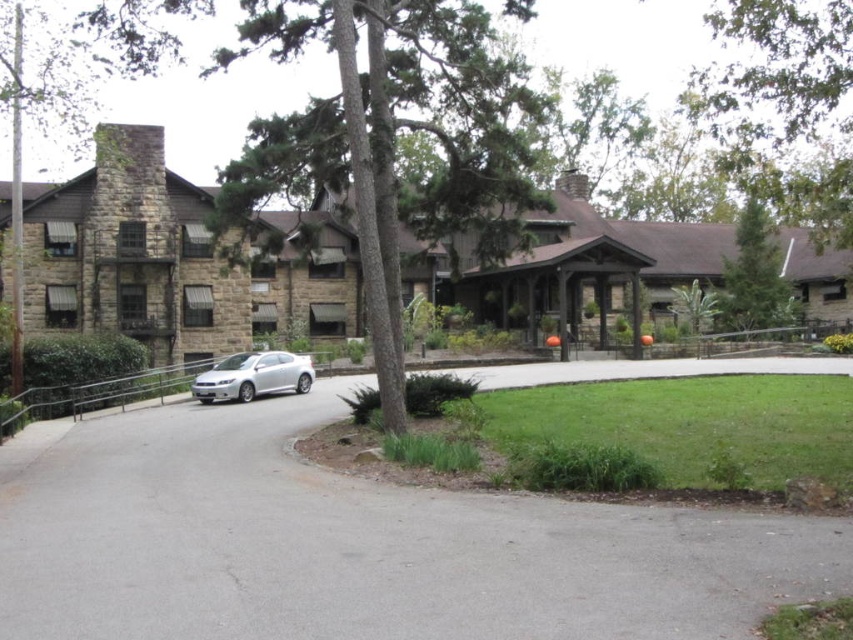
Question: Is gray asphalt driveway at center below green leafy tree at upper right?

Choices:
 (A) yes
 (B) no

Answer: (A)

Question: Which point appears farthest from the camera in this image?

Choices:
 (A) (764, 298)
 (B) (257, 385)
 (C) (401, 364)

Answer: (A)

Question: Does gray asphalt driveway at center appear over satin silver car at center?

Choices:
 (A) no
 (B) yes

Answer: (A)

Question: Can you confirm if gray asphalt driveway at center is positioned below satin silver car at center?

Choices:
 (A) yes
 (B) no

Answer: (A)

Question: Based on their relative distances, which object is nearer to the green leafy tree at upper right?

Choices:
 (A) green textured tree at center
 (B) gray asphalt driveway at center
 (C) green textured tree at upper right
 (D) satin silver car at center

Answer: (C)

Question: Which object is the farthest from the green textured tree at center?

Choices:
 (A) green leafy tree at upper right
 (B) green textured tree at upper right

Answer: (B)